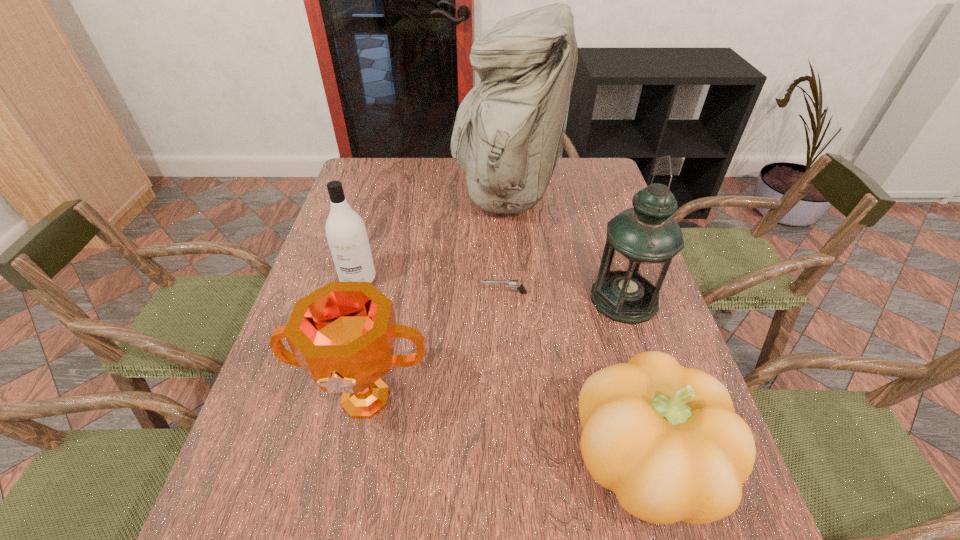
Identify which object is located as the fourth nearest to the shampoo. Please provide its 2D coordinates. Your answer should be formatted as a tuple, i.e. [(x, y)], where the tuple contains the x and y coordinates of a point satisfying the conditions above.

[(664, 438)]

Where is `free space that satisfies the following two spatial constraints: 1. on the front-facing side of the tallest object; 2. on the side of the award with the star emblem`? free space that satisfies the following two spatial constraints: 1. on the front-facing side of the tallest object; 2. on the side of the award with the star emblem is located at coordinates (519, 400).

The image size is (960, 540). I want to click on vacant space that satisfies the following two spatial constraints: 1. on the front-facing side of the pistol; 2. on the side of the award with the star emblem, so click(x=510, y=400).

I want to click on free space that satisfies the following two spatial constraints: 1. on the front-facing side of the oil lamp; 2. on the left side of the shampoo, so click(352, 299).

This screenshot has width=960, height=540. I want to click on free space that satisfies the following two spatial constraints: 1. on the front-facing side of the shampoo; 2. on the right side of the second tallest object, so click(x=352, y=299).